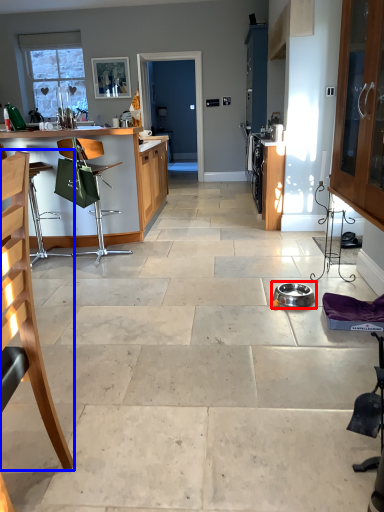
Question: Which point is further to the camera, appliance (highlighted by a red box) or chair (highlighted by a blue box)?

Choices:
 (A) appliance
 (B) chair

Answer: (A)